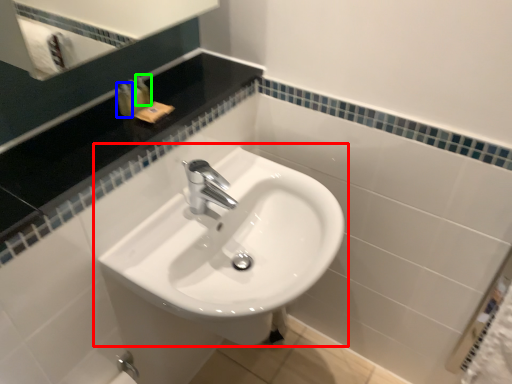
Question: Which is nearer to the sink (highlighted by a red box)? toiletry (highlighted by a blue box) or toiletry (highlighted by a green box).

Choices:
 (A) toiletry
 (B) toiletry

Answer: (A)